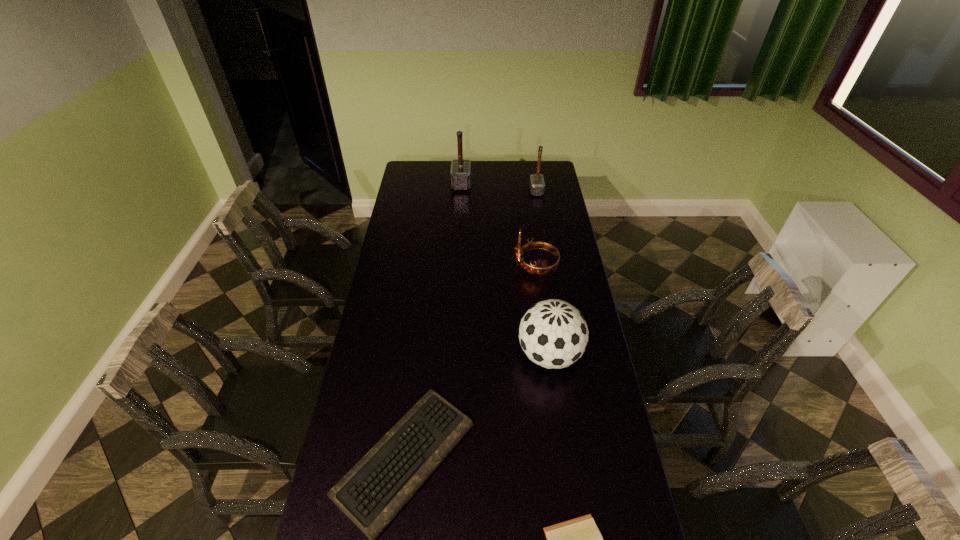
This screenshot has width=960, height=540. I want to click on vacant space located on the front-facing side of the tiara, so click(485, 267).

What are the coordinates of `vacant area situated 0.090m on the front-facing side of the tiara` in the screenshot? It's located at (493, 267).

The height and width of the screenshot is (540, 960). I want to click on vacant space located on the front-facing side of the tiara, so click(456, 267).

Where is `object that is positioned at the far edge`? The height and width of the screenshot is (540, 960). object that is positioned at the far edge is located at coordinates (460, 174).

The height and width of the screenshot is (540, 960). I want to click on hammer that is at the right edge, so click(x=537, y=185).

Find the location of a particular element. The image size is (960, 540). soccer ball present at the right edge is located at coordinates (553, 334).

At what (x,y) coordinates should I click in order to perform the action: click on tiara that is at the right edge. Please return your answer as a coordinate pair (x, y). This screenshot has width=960, height=540. Looking at the image, I should click on (532, 269).

Find the location of a particular element. This screenshot has height=540, width=960. vacant region at the left edge of the desktop is located at coordinates (411, 252).

You are a GUI agent. You are given a task and a screenshot of the screen. Output one action in this format:
    pyautogui.click(x=<x>, y=<y>)
    Task: Click on the vacant space at the right edge
    
    Given the screenshot: What is the action you would take?
    pyautogui.click(x=555, y=220)

The height and width of the screenshot is (540, 960). Identify the location of vacant space in between the tallest object and the third nearest object. (505, 269).